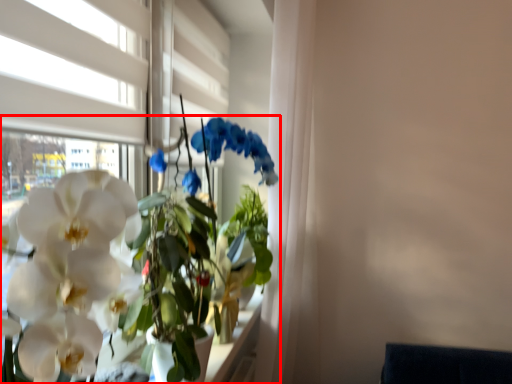
Question: Considering the relative positions of houseplant (annotated by the red box) and window in the image provided, where is houseplant (annotated by the red box) located with respect to the staircase?

Choices:
 (A) left
 (B) right

Answer: (B)